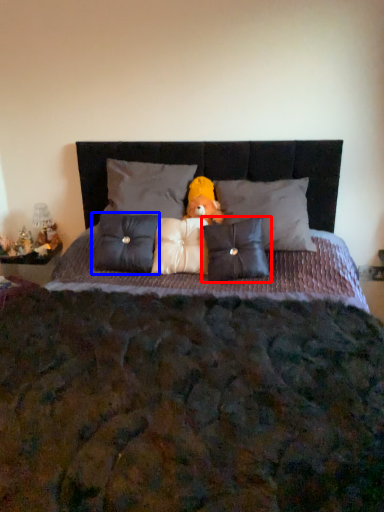
Question: Which object is closer to the camera taking this photo, pillow (highlighted by a red box) or pillow (highlighted by a blue box)?

Choices:
 (A) pillow
 (B) pillow

Answer: (A)